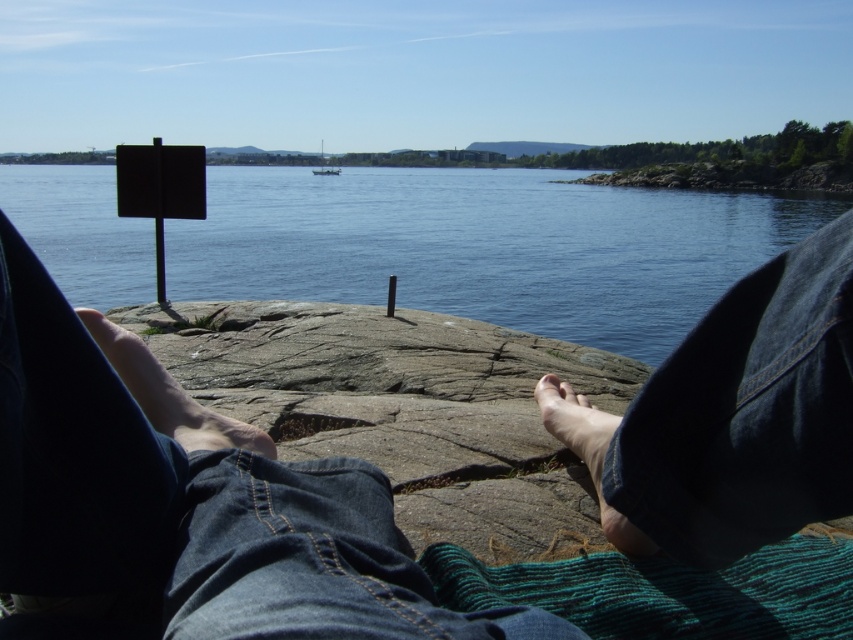
You are a photographer standing at the edge of the water. You want to take a closeup shot of the smooth skin foot at center and the matte skin toe at lower center. Can you focus on both objects clearly in the same photo without moving your camera?

The smooth skin foot at center is 32.64 inches away from the matte skin toe at lower center. Since they are at different distances from the camera, it might be challenging to focus both clearly in the same photo without adjusting the focus or depth of field.

You are standing at the edge of the water and see the jeans at center and the white plastic boat at center. Which object is closer to your right side?

The jeans at center are to the right of the white plastic boat at center, so the jeans at center are closer to your right side.